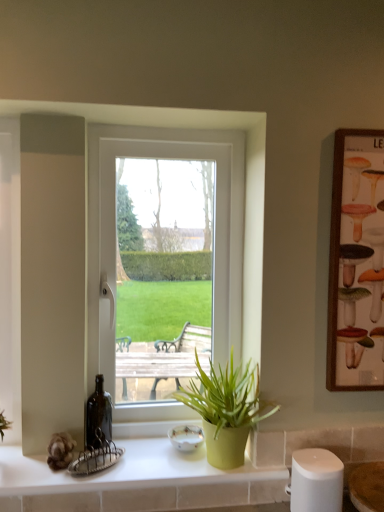
Question: In terms of height, does white glossy countertop at lower center look taller or shorter compared to wooden framed poster at right?

Choices:
 (A) short
 (B) tall

Answer: (A)

Question: From the image's perspective, is white glossy countertop at lower center positioned above or below wooden framed poster at right?

Choices:
 (A) above
 (B) below

Answer: (B)

Question: Estimate the real-world distances between objects in this image. Which object is closer to the wooden framed poster at right?

Choices:
 (A) white plastic window at center
 (B) white glossy countertop at lower center
 (C) green matte pot at lower center

Answer: (C)

Question: Estimate the real-world distances between objects in this image. Which object is farther from the green matte pot at lower center?

Choices:
 (A) wooden framed poster at right
 (B) white plastic window at center
 (C) white glossy countertop at lower center

Answer: (A)